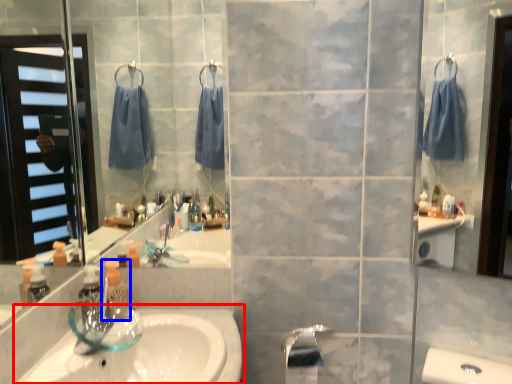
Question: Which object is further to the camera taking this photo, sink (highlighted by a red box) or soap dispenser (highlighted by a blue box)?

Choices:
 (A) sink
 (B) soap dispenser

Answer: (B)